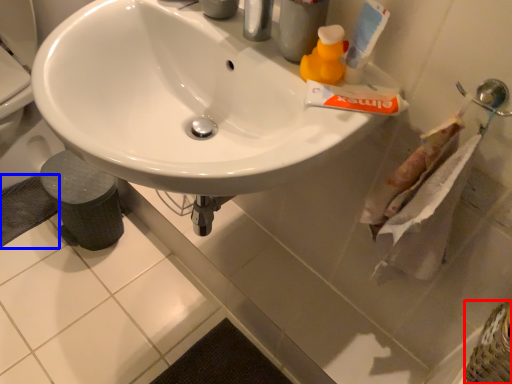
Question: Which object is further to the camera taking this photo, basket (highlighted by a red box) or bath mat (highlighted by a blue box)?

Choices:
 (A) basket
 (B) bath mat

Answer: (B)